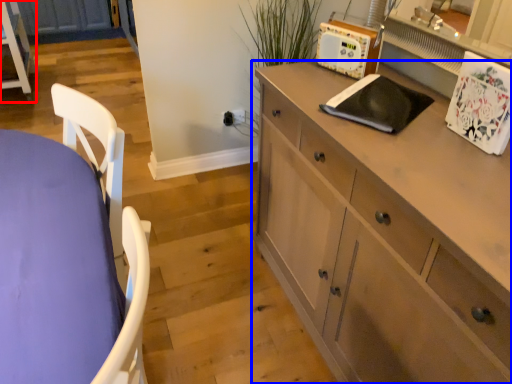
Question: Which object is further to the camera taking this photo, chest of drawers (highlighted by a red box) or cabinetry (highlighted by a blue box)?

Choices:
 (A) chest of drawers
 (B) cabinetry

Answer: (A)